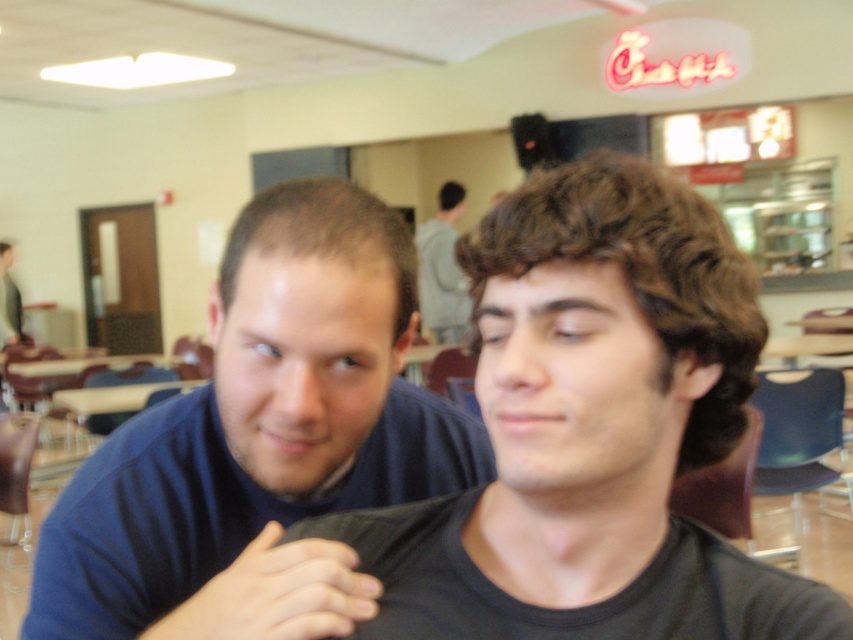
You are a person who wants to place a new item between the black matte phone at center and the gray hoodie at upper center. Which object should you place the new item closer to if you want it to be closer to the thinner object?

The black matte phone at center is thinner than the gray hoodie at upper center. Therefore, placing the new item closer to the black matte phone at center would ensure it is nearer to the thinner object.

What is the position of the point with coordinates (276, 595) in relation to the black matte phone at center?

The point with coordinates (276, 595) is located on the black matte phone at center.